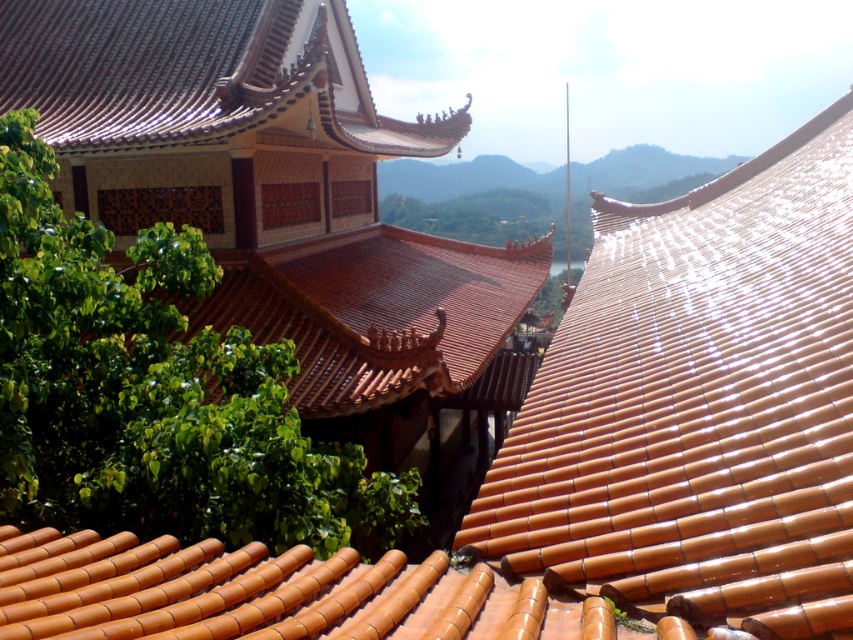
You are a landscape architect designing a garden path that needs to pass between the orange glazed tiles at upper right and the green leafy tree at center. The path must be at least 5 meters wide to accommodate a wheelchair. Can the path be safely constructed between these two features?

The orange glazed tiles at upper right is 5.47 meters from the green leafy tree at center. Since the required width is 5 meters and the distance is sufficient, the path can be safely constructed between these two features.